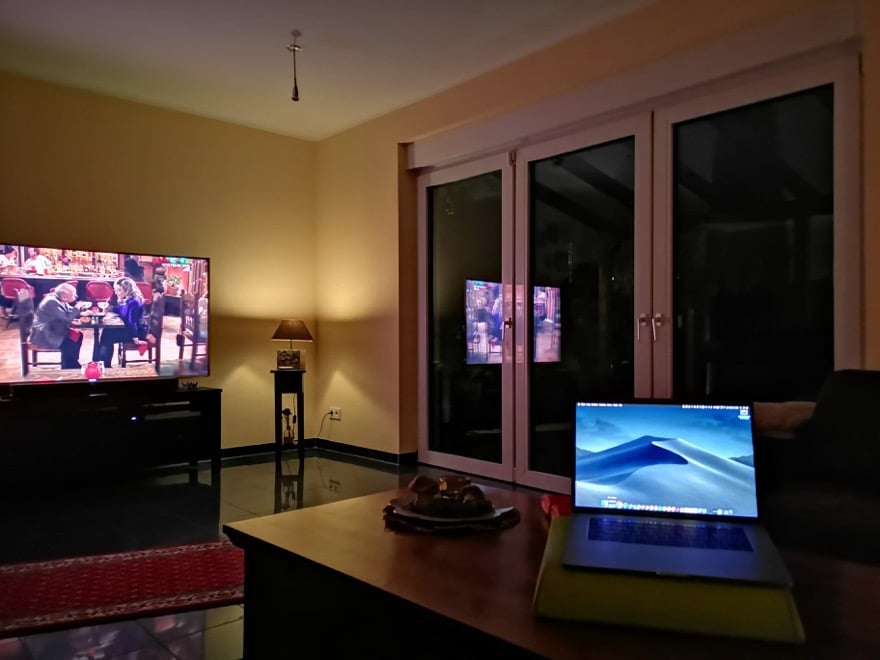
At what (x,y) coordinates should I click in order to perform the action: click on keyboard. Please return your answer as a coordinate pair (x, y). The image size is (880, 660). Looking at the image, I should click on (650, 529).